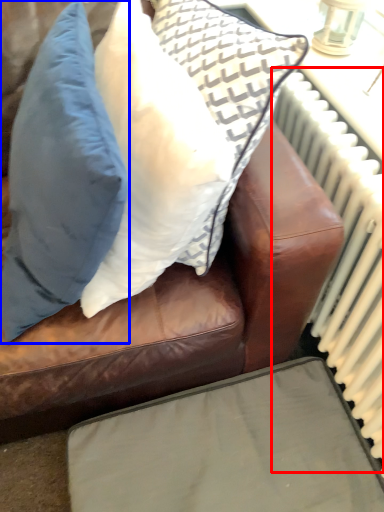
Question: Which object is further to the camera taking this photo, radiator (highlighted by a red box) or pillow (highlighted by a blue box)?

Choices:
 (A) radiator
 (B) pillow

Answer: (A)